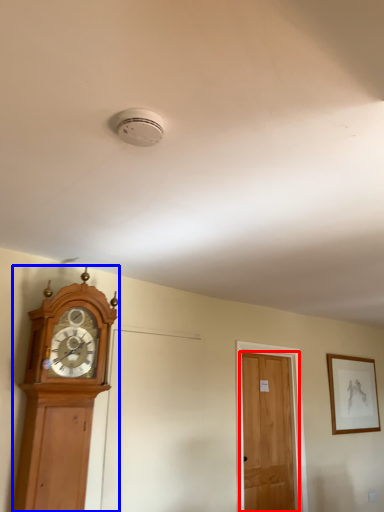
Question: Which object appears farthest to the camera in this image, door (highlighted by a red box) or wall clock (highlighted by a blue box)?

Choices:
 (A) door
 (B) wall clock

Answer: (A)